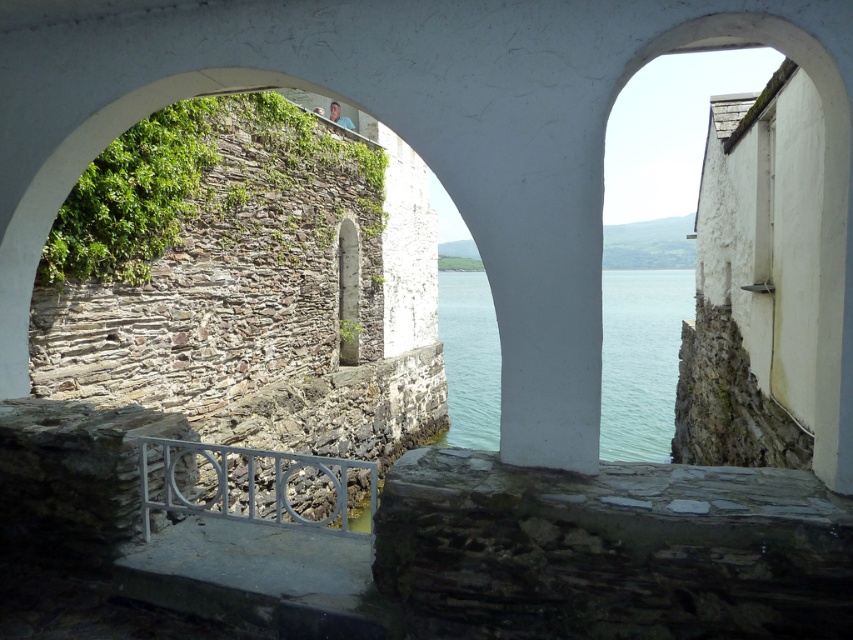
Question: Is clear water at center above metallic gray railing at lower center?

Choices:
 (A) yes
 (B) no

Answer: (A)

Question: Can you confirm if clear water at center is positioned to the left of metallic gray railing at lower center?

Choices:
 (A) no
 (B) yes

Answer: (A)

Question: Which point is closer to the camera taking this photo?

Choices:
 (A) (439, 323)
 (B) (322, 484)

Answer: (B)

Question: Which of the following is the closest to the observer?

Choices:
 (A) clear water at center
 (B) metallic gray railing at lower center

Answer: (A)

Question: Is clear water at center thinner than metallic gray railing at lower center?

Choices:
 (A) no
 (B) yes

Answer: (A)